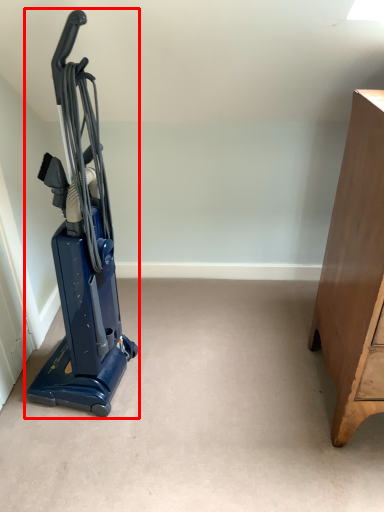
Question: Where is home appliance (annotated by the red box) located in relation to furniture in the image?

Choices:
 (A) right
 (B) left

Answer: (B)